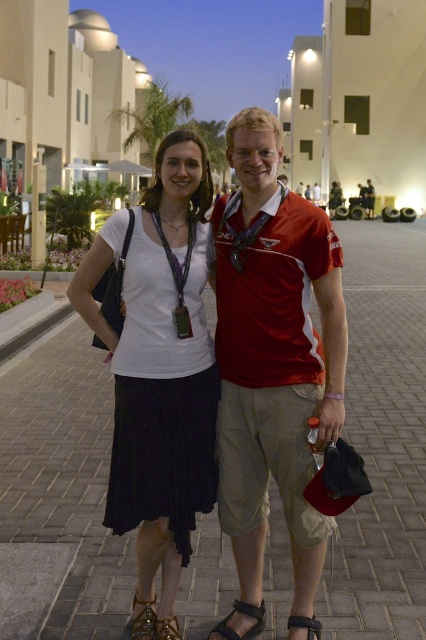
Question: Does gold metallic sandal at lower center have a smaller size compared to leather sandal at lower center?

Choices:
 (A) no
 (B) yes

Answer: (A)

Question: Where is brick pavement at center located in relation to gold metallic sandal at lower center in the image?

Choices:
 (A) above
 (B) below

Answer: (A)

Question: Is white matte skirt at center positioned behind brown leather sandal at lower center?

Choices:
 (A) no
 (B) yes

Answer: (A)

Question: Considering the real-world distances, which object is closest to the brick pavement at center?

Choices:
 (A) white matte skirt at center
 (B) black leather sandal at lower center
 (C) red fabric shirt at center
 (D) leather sandal at lower center

Answer: (A)

Question: Which point appears closest to the camera in this image?

Choices:
 (A) (135, 618)
 (B) (302, 618)
 (C) (158, 634)
 (D) (394, 481)

Answer: (C)

Question: Which point is closer to the camera?

Choices:
 (A) black leather sandal at lower center
 (B) gold metallic sandal at lower center
 (C) brick pavement at center

Answer: (B)